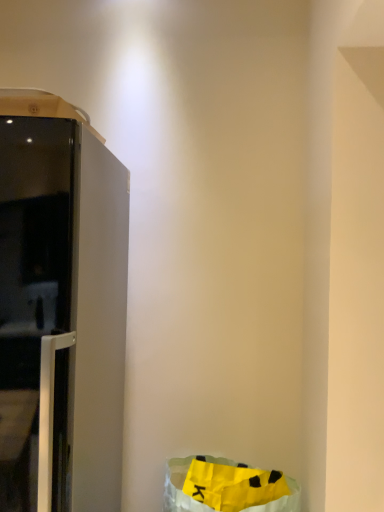
This screenshot has height=512, width=384. What are the coordinates of `satin white refrigerator at left` in the screenshot? It's located at (61, 304).

The width and height of the screenshot is (384, 512). What do you see at coordinates (61, 304) in the screenshot?
I see `satin white refrigerator at left` at bounding box center [61, 304].

Locate an element on the screen. The width and height of the screenshot is (384, 512). yellow paper bag at lower right is located at coordinates (226, 487).

Describe the element at coordinates (226, 487) in the screenshot. I see `yellow paper bag at lower right` at that location.

I want to click on satin white refrigerator at left, so click(x=61, y=304).

Can you confirm if yellow paper bag at lower right is positioned to the right of satin white refrigerator at left?

Yes.

Is yellow paper bag at lower right positioned behind satin white refrigerator at left?

Yes, yellow paper bag at lower right is further from the viewer.

Which point is more forward, (216, 480) or (104, 244)?

The point (104, 244) is closer.

From the picture: From the image's perspective, relative to satin white refrigerator at left, is yellow paper bag at lower right above or below?

From the image's perspective, yellow paper bag at lower right appears below satin white refrigerator at left.

From a real-world perspective, is yellow paper bag at lower right positioned above or below satin white refrigerator at left?

From a real-world perspective, yellow paper bag at lower right is physically below satin white refrigerator at left.

Considering the relative sizes of yellow paper bag at lower right and satin white refrigerator at left in the image provided, is yellow paper bag at lower right wider than satin white refrigerator at left?

In fact, yellow paper bag at lower right might be narrower than satin white refrigerator at left.

Between yellow paper bag at lower right and satin white refrigerator at left, which one has less height?

yellow paper bag at lower right is shorter.

Can you confirm if yellow paper bag at lower right is smaller than satin white refrigerator at left?

Indeed, yellow paper bag at lower right has a smaller size compared to satin white refrigerator at left.

Is yellow paper bag at lower right inside or outside of satin white refrigerator at left?

yellow paper bag at lower right is outside satin white refrigerator at left.

Is yellow paper bag at lower right beside satin white refrigerator at left?

No.

In the scene shown: Could you tell me if yellow paper bag at lower right is facing satin white refrigerator at left?

No, yellow paper bag at lower right is not aimed at satin white refrigerator at left.

Image resolution: width=384 pixels, height=512 pixels. I want to click on furniture that is in front of the yellow paper bag at lower right, so click(x=61, y=304).

Is satin white refrigerator at left to the left of yellow paper bag at lower right from the viewer's perspective?

Correct, you'll find satin white refrigerator at left to the left of yellow paper bag at lower right.

In the image, is satin white refrigerator at left positioned in front of or behind yellow paper bag at lower right?

Answer: In the image, satin white refrigerator at left appears in front of yellow paper bag at lower right.

Does point (53, 391) come closer to viewer compared to point (297, 493)?

Yes, it is in front of point (297, 493).

From the image's perspective, which object appears higher, satin white refrigerator at left or yellow paper bag at lower right?

satin white refrigerator at left, from the image's perspective.

From a real-world perspective, which object rests below the other?

yellow paper bag at lower right, from a real-world perspective.

Between satin white refrigerator at left and yellow paper bag at lower right, which one has larger width?

satin white refrigerator at left is wider.

In terms of height, does satin white refrigerator at left look taller or shorter compared to yellow paper bag at lower right?

satin white refrigerator at left is taller than yellow paper bag at lower right.

Based on their sizes in the image, would you say satin white refrigerator at left is bigger or smaller than yellow paper bag at lower right?

Clearly, satin white refrigerator at left is larger in size than yellow paper bag at lower right.

Is satin white refrigerator at left inside the boundaries of yellow paper bag at lower right, or outside?

The correct answer is: outside.

Is satin white refrigerator at left in contact with yellow paper bag at lower right?

No, satin white refrigerator at left is not beside yellow paper bag at lower right.

Does satin white refrigerator at left turn towards yellow paper bag at lower right?

No, satin white refrigerator at left does not turn towards yellow paper bag at lower right.

Can you tell me how much satin white refrigerator at left and yellow paper bag at lower right differ in facing direction?

satin white refrigerator at left and yellow paper bag at lower right are facing 0.000136 degrees away from each other.

In the image, there is a satin white refrigerator at left. What are the coordinates of `recycling bin below it (from the image's perspective)` in the screenshot? It's located at (226, 487).

Find the location of a particular element. The width and height of the screenshot is (384, 512). furniture lying above the yellow paper bag at lower right (from the image's perspective) is located at coordinates (61, 304).

Identify the location of furniture that appears on the left of yellow paper bag at lower right. (61, 304).